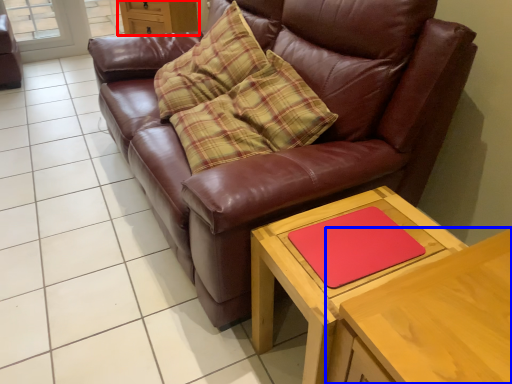
Question: Among these objects, which one is nearest to the camera, dresser (highlighted by a red box) or table (highlighted by a blue box)?

Choices:
 (A) dresser
 (B) table

Answer: (B)